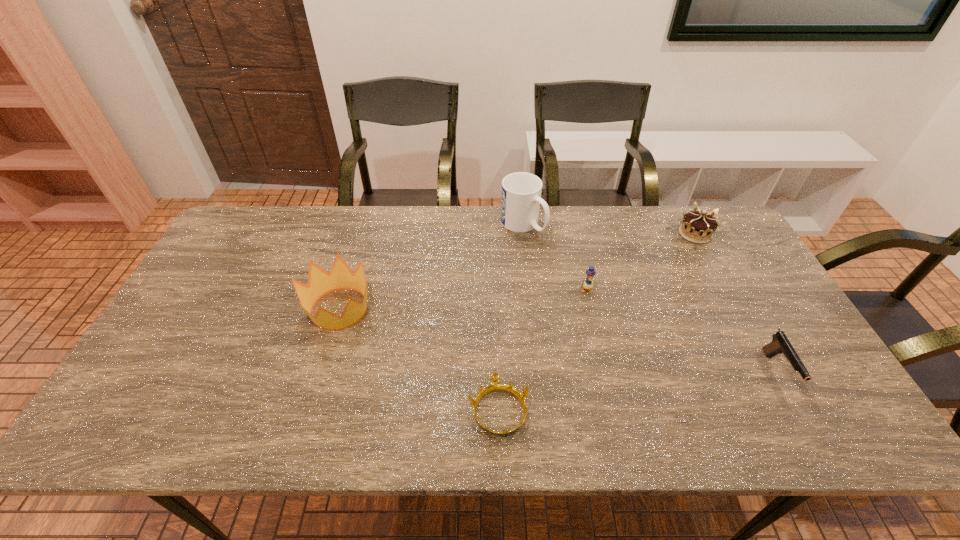
Find the location of a particular element. vacant space located on the right of the second farthest crown is located at coordinates (499, 309).

At what (x,y) coordinates should I click in order to perform the action: click on vacant space situated 0.250m on the front of the second shortest crown. Please return your answer as a coordinate pair (x, y). The height and width of the screenshot is (540, 960). Looking at the image, I should click on (734, 307).

You are a GUI agent. You are given a task and a screenshot of the screen. Output one action in this format:
    pyautogui.click(x=<x>, y=<y>)
    Task: Click on the vacant region located 0.300m on the face of the duckling, where the monocle is placed
    The width and height of the screenshot is (960, 540).
    Given the screenshot: What is the action you would take?
    pyautogui.click(x=609, y=384)

At what (x,y) coordinates should I click in order to perform the action: click on vacant space situated 0.090m at the muzzle of the pistol. Please return your answer as a coordinate pair (x, y). Looking at the image, I should click on (812, 434).

In order to click on vacant area located 0.190m on the back of the shortest object in this screenshot , I will do `click(496, 323)`.

The width and height of the screenshot is (960, 540). I want to click on mug present at the far edge, so click(521, 192).

Image resolution: width=960 pixels, height=540 pixels. I want to click on crown that is at the far edge, so click(698, 226).

Locate an element on the screen. object at the near edge is located at coordinates (495, 386).

At what (x,y) coordinates should I click in order to perform the action: click on crown that is positioned at the right edge. Please return your answer as a coordinate pair (x, y). The height and width of the screenshot is (540, 960). Looking at the image, I should click on pyautogui.click(x=698, y=226).

Identify the location of pistol located in the right edge section of the desktop. This screenshot has width=960, height=540. (780, 344).